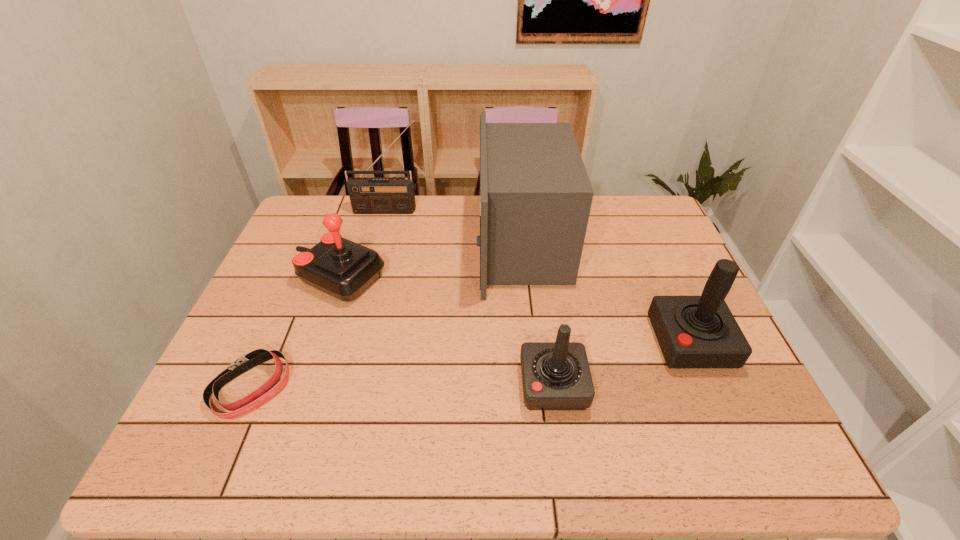
This screenshot has height=540, width=960. In order to click on microwave oven in this screenshot , I will do `click(535, 195)`.

At what (x,y) coordinates should I click in order to perform the action: click on radio receiver. Please return your answer as a coordinate pair (x, y). The width and height of the screenshot is (960, 540). Looking at the image, I should click on (394, 195).

Locate an element on the screen. the rightmost joystick is located at coordinates (692, 331).

Find the location of a particular element. The image size is (960, 540). the farthest joystick is located at coordinates (343, 269).

I want to click on the second joystick from left to right, so click(556, 375).

Image resolution: width=960 pixels, height=540 pixels. In order to click on the shortest joystick in this screenshot , I will do `click(556, 375)`.

Find the location of a particular element. This screenshot has height=540, width=960. dog collar is located at coordinates (255, 399).

The width and height of the screenshot is (960, 540). Find the location of `free point located on the front-facing side of the microwave oven`. free point located on the front-facing side of the microwave oven is located at coordinates (393, 242).

This screenshot has width=960, height=540. Identify the location of vacant space situated 0.120m on the front-facing side of the microwave oven. (438, 242).

Identify the location of vacant space located on the front-facing side of the microwave oven. This screenshot has width=960, height=540. (415, 242).